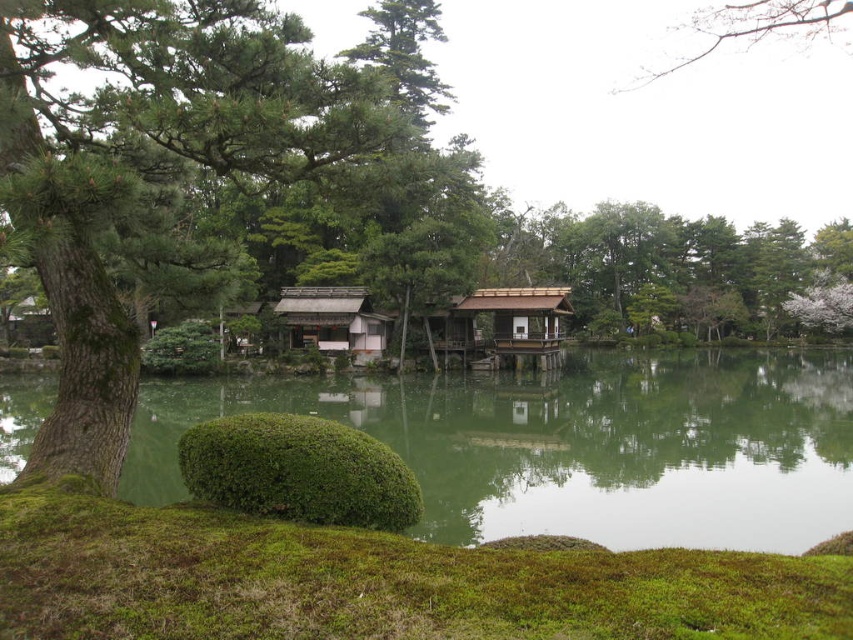
You are a visitor in the garden wanting to walk from the mossy bush to the brown wooden hut at center. The path goes through the green reflective water at center. Can you safely walk across the water?

The green reflective water at center and brown wooden hut at center are 9.56 meters apart. However, the question mentions walking through the green reflective water at center, but the objects description does not provide information about the water depth or path safety. Therefore, it is unclear if the water can be safely crossed.

You are planning to build a small wooden dock on the pond in the Japanese garden scene. The dock needs to be larger than the brown wooden hut at center. Can the green reflective water at center accommodate the dock based on their sizes?

The green reflective water at center is bigger than the brown wooden hut at center, so the dock can be accommodated as it needs to be larger than the hut but the water surface is sufficiently large enough to hold it.

You are standing in the Japanese garden and want to take a photo of the wooden shingled hut at center. However, the green reflective water at center is blocking your view. Can you move to the left to get a clear shot without the water in the frame?

The green reflective water at center is closer to the viewer than the wooden shingled hut at center. Moving to the left might not help because the water is in front of the hut, so the hut is behind the water. You need to move around to a position where the water is not between you and the hut.